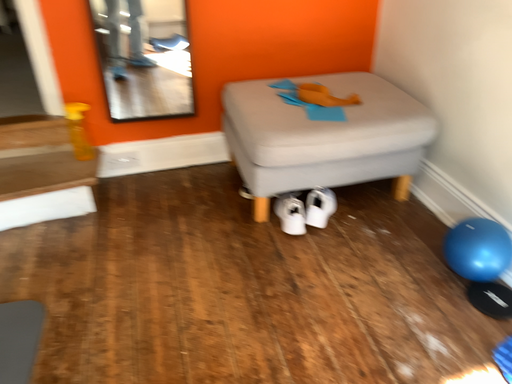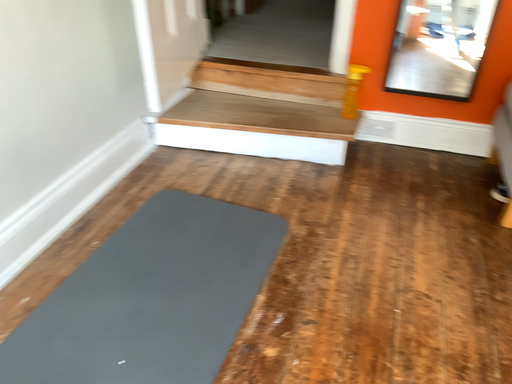
Question: Which way did the camera rotate in the video?

Choices:
 (A) rotated right
 (B) rotated left

Answer: (B)